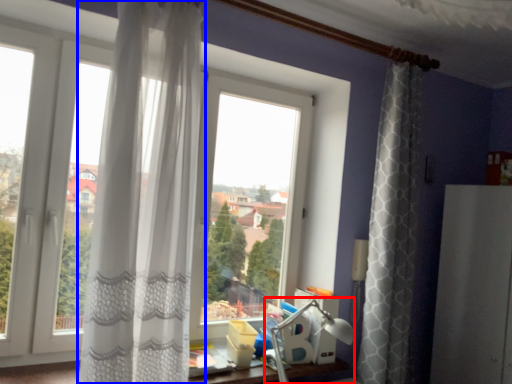
Question: Which object is further to the camera taking this photo, table lamp (highlighted by a red box) or curtain (highlighted by a blue box)?

Choices:
 (A) table lamp
 (B) curtain

Answer: (A)